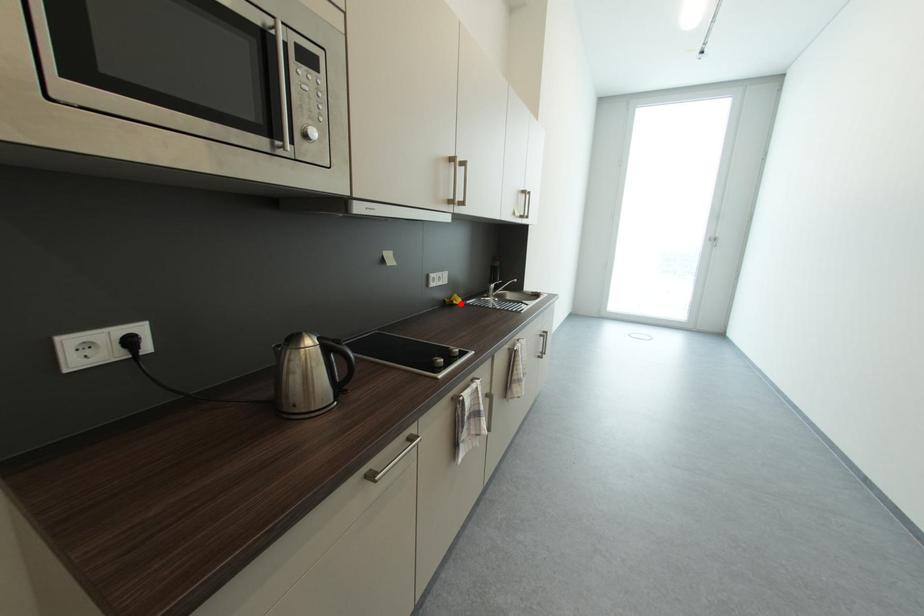
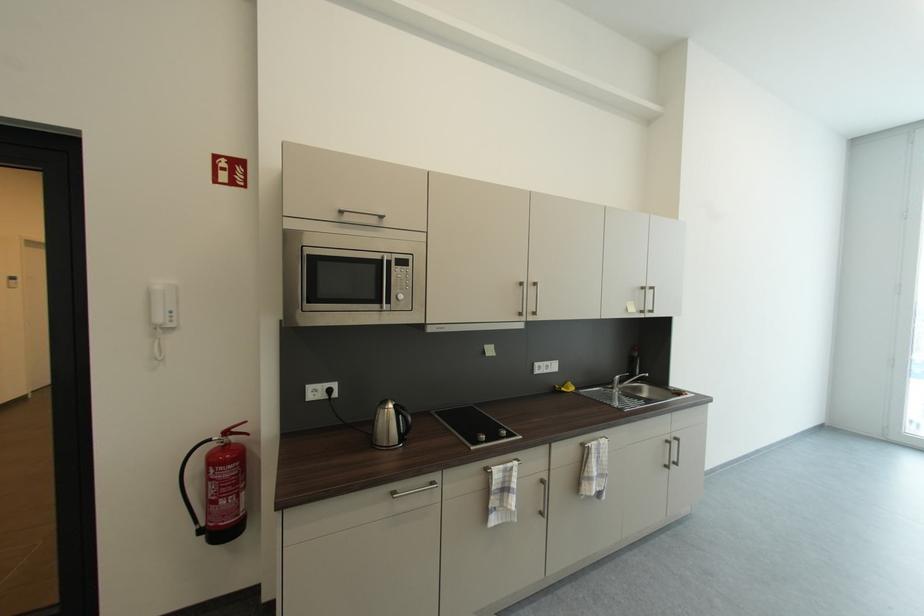
Question: I am providing you with two images of the same scene from different viewpoints. In image1, a red point is highlighted. Considering the same 3D point in image2, which of the following is correct?

Choices:
 (A) It is closer
 (B) It is farther

Answer: (B)